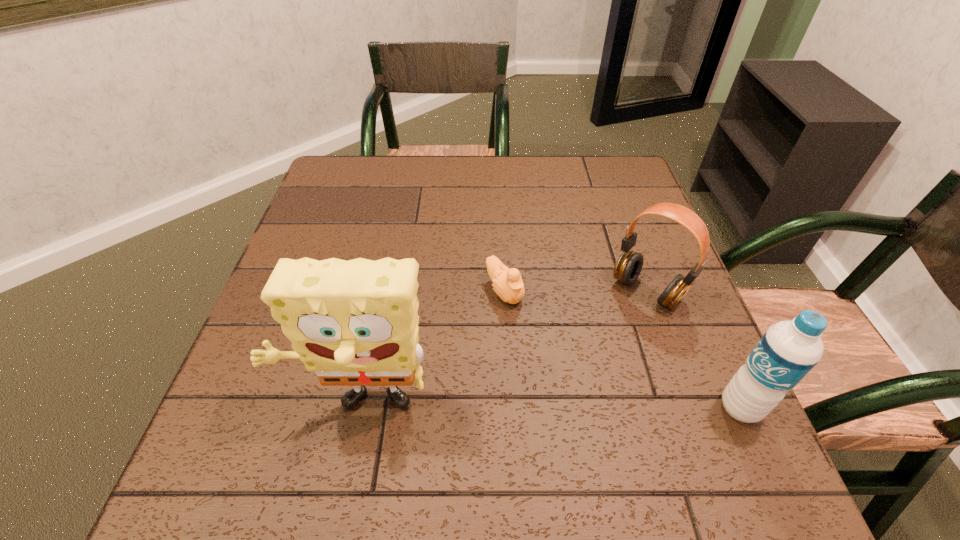
Where is `object that is at the near left corner`? The width and height of the screenshot is (960, 540). object that is at the near left corner is located at coordinates (355, 323).

Identify the location of object present at the near right corner. pyautogui.click(x=786, y=353).

Locate an element on the screen. Image resolution: width=960 pixels, height=540 pixels. vacant region at the far edge of the desktop is located at coordinates (444, 181).

Where is `free spot at the near edge of the desktop`? This screenshot has width=960, height=540. free spot at the near edge of the desktop is located at coordinates (337, 402).

I want to click on free point at the left edge, so [x=306, y=249].

At what (x,y) coordinates should I click in order to perform the action: click on free region at the right edge of the desktop. Please return your answer as a coordinate pair (x, y). Looking at the image, I should click on (643, 226).

In the image, there is a desktop. What are the coordinates of `vacant area at the near left corner` in the screenshot? It's located at (227, 420).

At what (x,y) coordinates should I click in order to perform the action: click on free space at the far right corner. Please return your answer as a coordinate pair (x, y). This screenshot has height=540, width=960. Looking at the image, I should click on click(x=593, y=181).

The width and height of the screenshot is (960, 540). What are the coordinates of `vacant space at the near right corner of the desktop` in the screenshot? It's located at (678, 411).

At what (x,y) coordinates should I click in order to perform the action: click on empty location between the water bottle and the second shortest object. Please return your answer as a coordinate pair (x, y). This screenshot has width=960, height=540. Looking at the image, I should click on (693, 349).